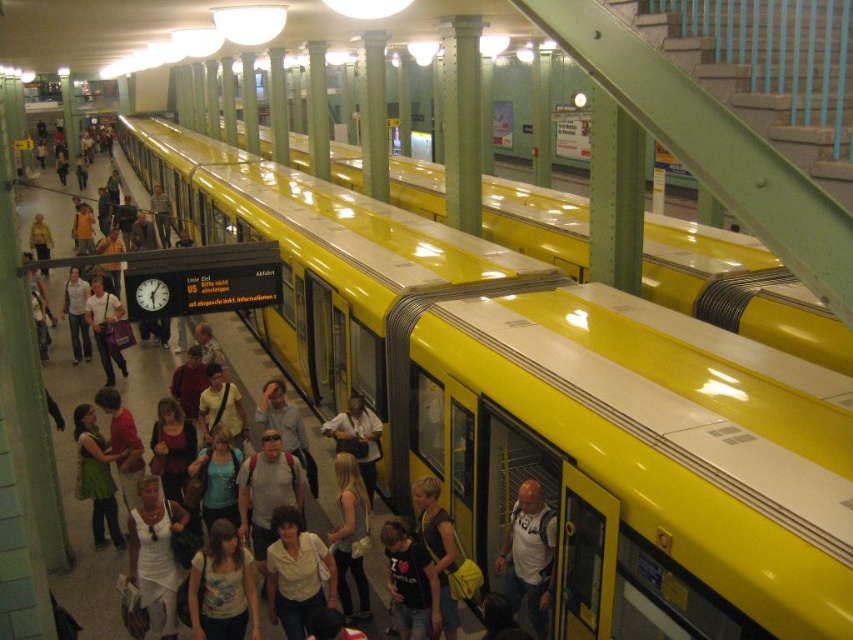
You are a photographer standing at the subway station. You want to take a photo of the yellow matte train at center. If your camera can focus on objects up to 10 feet away, will you need to move closer or farther away to get a clear shot?

The yellow matte train at center is 11.29 feet away from camera, which is beyond the camera focus range of 10 feet. Therefore, you need to move closer to the yellow matte train at center to get a clear shot.

You are standing at the point closer to the train doors. There are two points marked in the scene, one at point coordinates point (677,630) and another at point (741,237). Which point is closer to the train doors?

Point (677,630) is in front of point (741,237), so the point closer to the train doors is point (677,630).